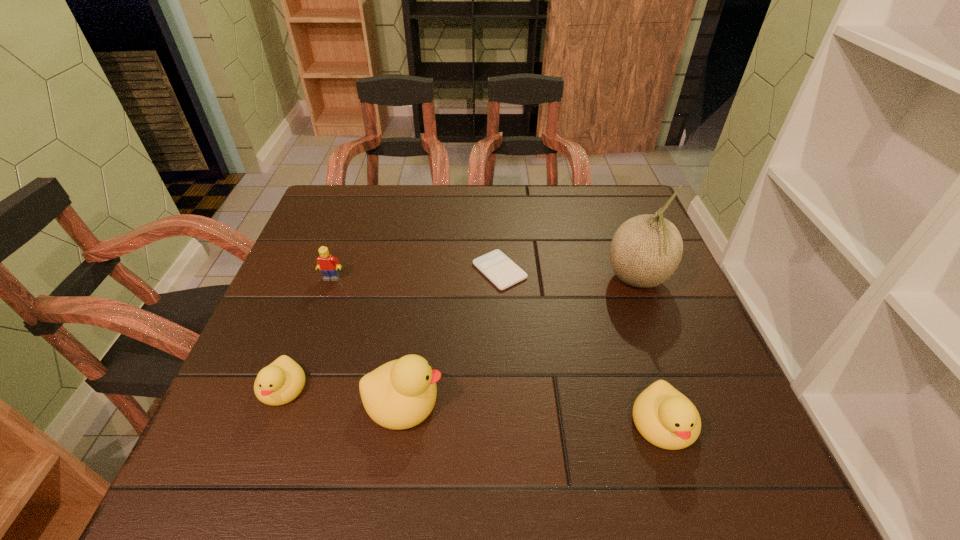
Locate an element on the screen. The image size is (960, 540). vacant position located 0.200m on the front-facing side of the Lego is located at coordinates (307, 347).

This screenshot has height=540, width=960. What are the coordinates of `free location located on the front of the shortest object` in the screenshot? It's located at (506, 404).

This screenshot has height=540, width=960. In order to click on free space located on the back of the cantaloup in this screenshot , I will do `click(621, 238)`.

What are the coordinates of `duckling at the left edge` in the screenshot? It's located at (280, 382).

This screenshot has height=540, width=960. Find the location of `Lego present at the left edge`. Lego present at the left edge is located at coordinates (329, 265).

You are a GUI agent. You are given a task and a screenshot of the screen. Output one action in this format:
    pyautogui.click(x=<x>, y=<y>)
    Task: Click on the duckling present at the right edge
    The height and width of the screenshot is (540, 960).
    Given the screenshot: What is the action you would take?
    pyautogui.click(x=666, y=418)

The height and width of the screenshot is (540, 960). Find the location of `cantaloup that is at the right edge`. cantaloup that is at the right edge is located at coordinates (645, 251).

Find the location of `object at the near left corner`. object at the near left corner is located at coordinates (280, 382).

Find the location of `object present at the near right corner`. object present at the near right corner is located at coordinates (666, 418).

You are a GUI agent. You are given a task and a screenshot of the screen. Output one action in this format:
    pyautogui.click(x=<x>, y=<y>)
    Task: Click on the vacant space at the far edge
    
    Given the screenshot: What is the action you would take?
    pyautogui.click(x=468, y=202)